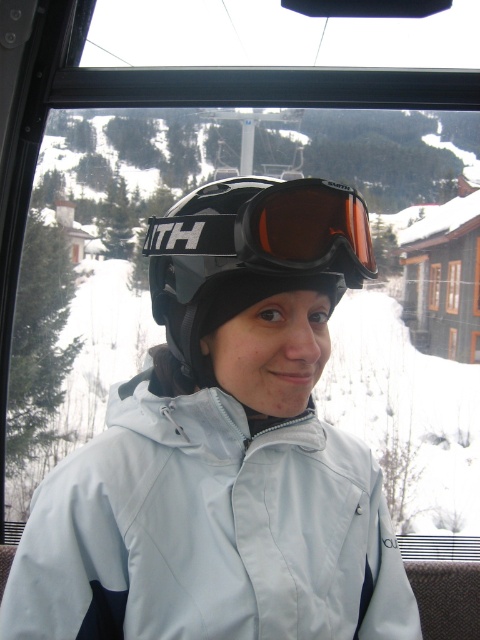
You are inside a ski lift cabin and want to reach the exit door. The exit door is located at point (344, 218). You are currently at point (282, 637). Can you move directly to the exit door without needing to go around any obstacles?

Point (282, 637) is behind point (344, 218), so you cannot move directly to the exit door located at point (344, 218) without needing to go around obstacles since your current position is behind it.

You are a photographer trying to capture a photo of the light blue fabric jacket at center and the black matte helmet at center. Based on their positions, which object should you focus on first to ensure both are in the frame?

The light blue fabric jacket at center is positioned on the right side of the black matte helmet at center. To ensure both are in the frame, focus on the black matte helmet at center first, then adjust to include the light blue fabric jacket at center on the right.